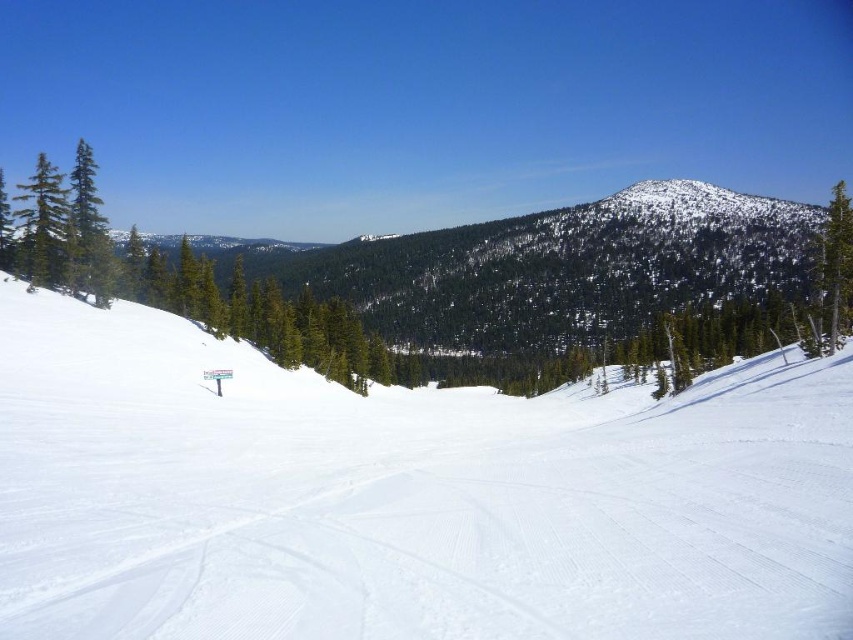
You are a skier planning to descend the slope. You see the white smooth snow at center and the green textured pine at center. Which object is positioned to the left when looking downhill?

The white smooth snow at center is to the left of the green textured pine at center, so the white smooth snow at center is positioned to the left when looking downhill.

You are a skier planning to descend the slope. You see the white smooth snow at center and the green textured pine at center. Which object will you encounter first as you go down the slope?

The white smooth snow at center is located below the green textured pine at center, so you will encounter the white smooth snow at center first as you go down the slope.

You are planning to build a snowman using the white smooth snow at center and the green textured pine at center. Which material would you choose and why?

You should choose the white smooth snow at center because it is snow, which is the appropriate material for building a snowman. The green textured pine at center is a tree and cannot be used for this purpose.